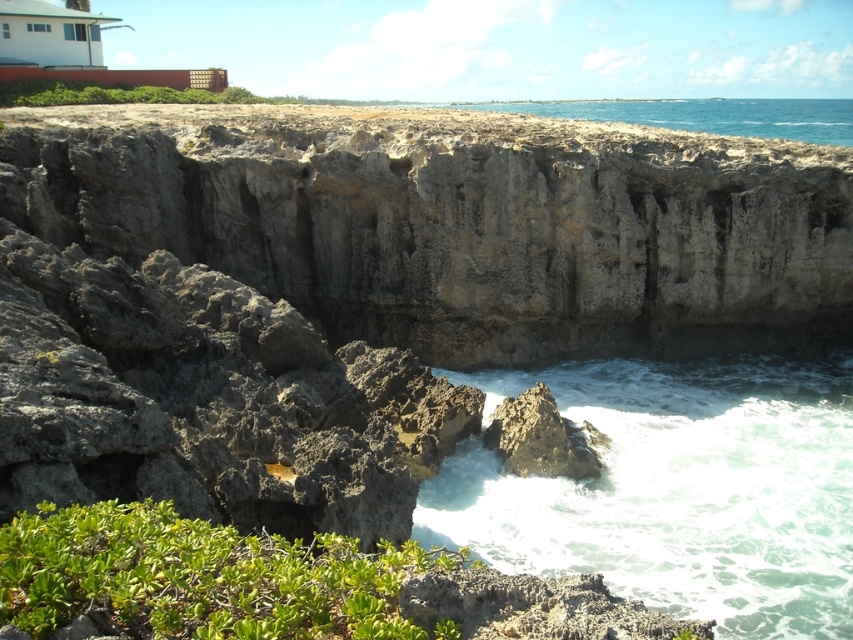
Looking at this image, between blue water at upper center and rough textured rock at lower center, which one is positioned lower?

rough textured rock at lower center is lower down.

Which is more to the right, blue water at upper center or rough textured rock at lower center?

blue water at upper center

Describe the element at coordinates (706, 115) in the screenshot. I see `blue water at upper center` at that location.

You are a GUI agent. You are given a task and a screenshot of the screen. Output one action in this format:
    pyautogui.click(x=<x>, y=<y>)
    Task: Click on the blue water at upper center
    
    Given the screenshot: What is the action you would take?
    pyautogui.click(x=706, y=115)

Looking at this image, between white frothy water at lower center and blue water at upper center, which one is positioned higher?

blue water at upper center is higher up.

Can you confirm if white frothy water at lower center is shorter than blue water at upper center?

Correct, white frothy water at lower center is not as tall as blue water at upper center.

Based on the photo, who is more forward, (x=770, y=616) or (x=654, y=115)?

Point (x=770, y=616)

Locate an element on the screen. white frothy water at lower center is located at coordinates (677, 490).

Is white frothy water at lower center bigger than rough textured rock at lower center?

Yes, white frothy water at lower center is bigger than rough textured rock at lower center.

Does white frothy water at lower center have a lesser width compared to rough textured rock at lower center?

No, white frothy water at lower center is not thinner than rough textured rock at lower center.

Who is more forward, (712,387) or (567,451)?

Positioned in front is point (567,451).

You are a GUI agent. You are given a task and a screenshot of the screen. Output one action in this format:
    pyautogui.click(x=<x>, y=<y>)
    Task: Click on the white frothy water at lower center
    Image resolution: width=853 pixels, height=640 pixels.
    Given the screenshot: What is the action you would take?
    pyautogui.click(x=677, y=490)